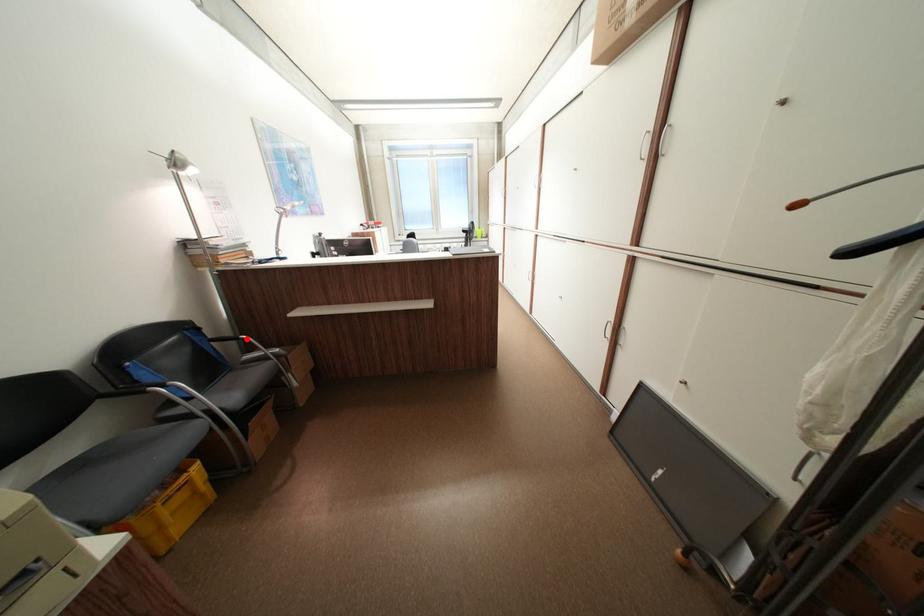
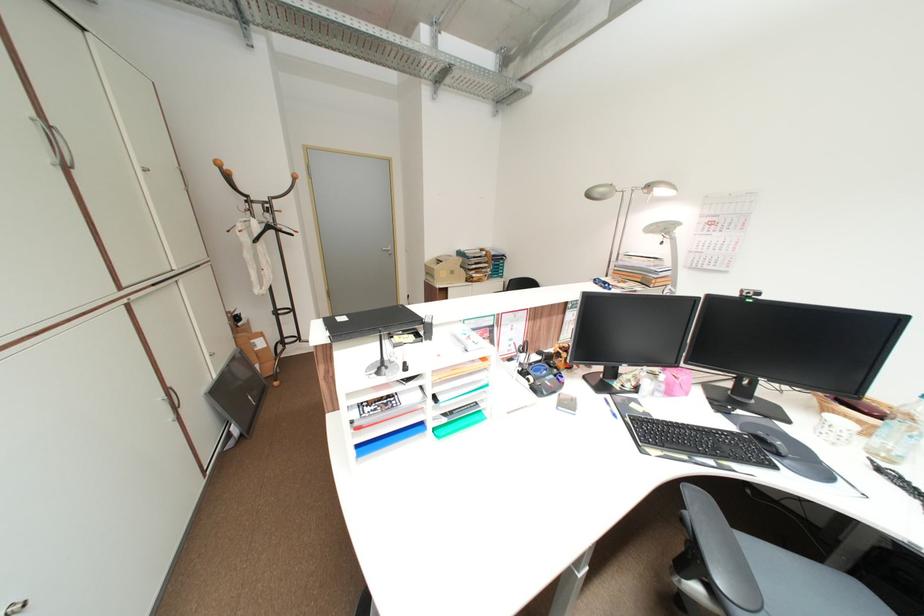
Question: I am providing you with two images of the same scene from different viewpoints. A red point is marked on the first image. At the location where the point appears in image 1, is it still visible in image 2?

Choices:
 (A) Yes
 (B) No

Answer: (B)